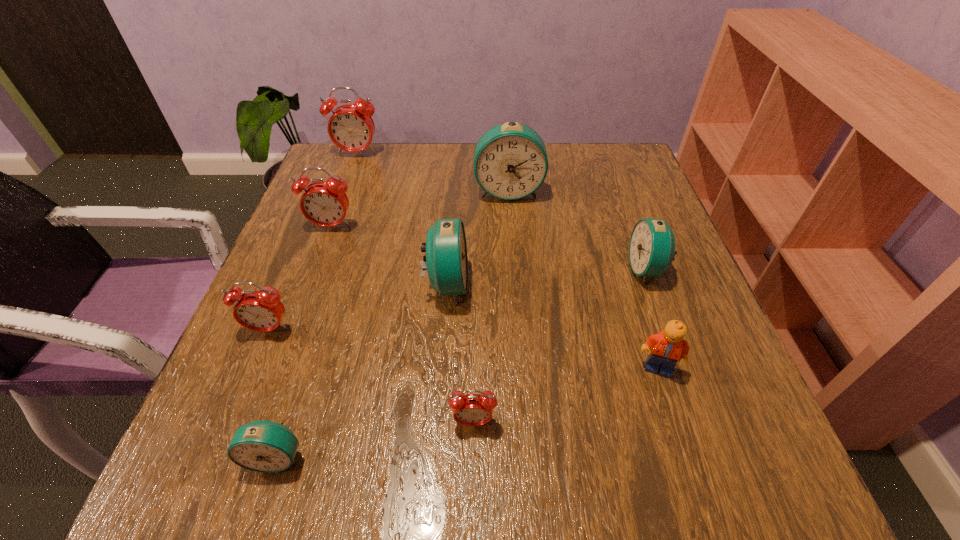
This screenshot has width=960, height=540. Find the location of `object that is at the far left corner`. object that is at the far left corner is located at coordinates (350, 127).

At what (x,y) coordinates should I click in order to perform the action: click on object present at the near left corner. Please return your answer as a coordinate pair (x, y). This screenshot has height=540, width=960. Looking at the image, I should click on (265, 446).

This screenshot has width=960, height=540. In the image, there is a desktop. Find the location of `vacant space at the far edge`. vacant space at the far edge is located at coordinates (444, 187).

At what (x,y) coordinates should I click in order to perform the action: click on vacant space at the near edge of the desktop. Please return your answer as a coordinate pair (x, y). Image resolution: width=960 pixels, height=540 pixels. Looking at the image, I should click on (318, 481).

I want to click on free region at the left edge of the desktop, so click(x=253, y=359).

The width and height of the screenshot is (960, 540). I want to click on blank area at the right edge, so click(632, 281).

At what (x,y) coordinates should I click in order to perform the action: click on free location at the far right corner. Please return your answer as a coordinate pair (x, y). This screenshot has width=960, height=540. Looking at the image, I should click on (573, 153).

Identify the location of free point at the near right corner. (723, 443).

The height and width of the screenshot is (540, 960). I want to click on vacant space that is in between the farthest alarm clock and the rightmost alarm clock, so click(x=502, y=212).

You are a GUI agent. You are given a task and a screenshot of the screen. Output one action in this format:
    pyautogui.click(x=<x>, y=<y>)
    Task: Click on the empty location between the third smallest blue alarm clock and the farthest red alarm clock
    This screenshot has height=540, width=960.
    Given the screenshot: What is the action you would take?
    pyautogui.click(x=401, y=219)